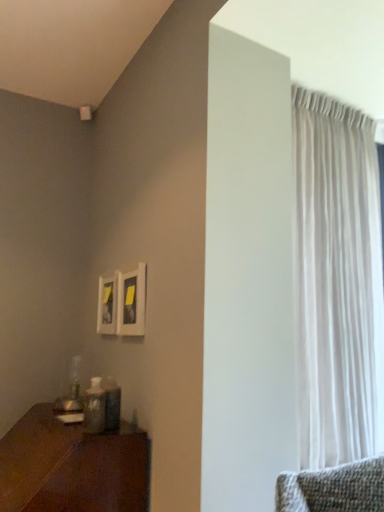
Question: Is white sheer curtain at right bigger or smaller than wooden table at lower left?

Choices:
 (A) small
 (B) big

Answer: (A)

Question: Considering the positions of white sheer curtain at right and wooden table at lower left in the image, is white sheer curtain at right taller or shorter than wooden table at lower left?

Choices:
 (A) tall
 (B) short

Answer: (A)

Question: Considering their positions, is white sheer curtain at right located in front of or behind wooden table at lower left?

Choices:
 (A) behind
 (B) front

Answer: (A)

Question: Would you say wooden table at lower left is inside or outside white sheer curtain at right?

Choices:
 (A) inside
 (B) outside

Answer: (B)

Question: From a real-world perspective, is wooden table at lower left physically located above or below white sheer curtain at right?

Choices:
 (A) above
 (B) below

Answer: (B)

Question: Is point (114, 489) positioned closer to the camera than point (364, 189)?

Choices:
 (A) closer
 (B) farther

Answer: (A)

Question: Considering the relative positions of wooden table at lower left and white sheer curtain at right in the image provided, is wooden table at lower left to the left or to the right of white sheer curtain at right?

Choices:
 (A) right
 (B) left

Answer: (B)